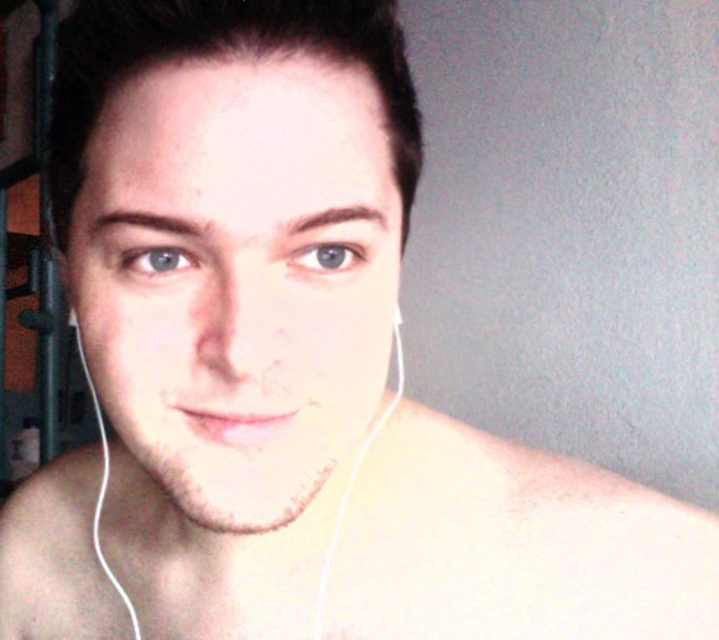
You are a photographer adjusting lighting for a portrait. You notice the smooth skin earphones at center and the white earphone at left. Which earphone is positioned higher in the image?

The smooth skin earphones at center is taller than the white earphone at left, so the smooth skin earphones at center is positioned higher in the image.

You are a photographer adjusting the lighting for a portrait. You notice a point at coordinates (x=352, y=488) in the image. Based on the scene description, what object is located at this point?

The point at coordinates (x=352, y=488) corresponds to the smooth skin earphones at center.

You are a photographer trying to adjust the lighting for a portrait. You notice the smooth skin earphones at center and the white earphone at left. Which earphone is positioned lower in the frame?

The smooth skin earphones at center is located below the white earphone at left, so it is positioned lower in the frame.